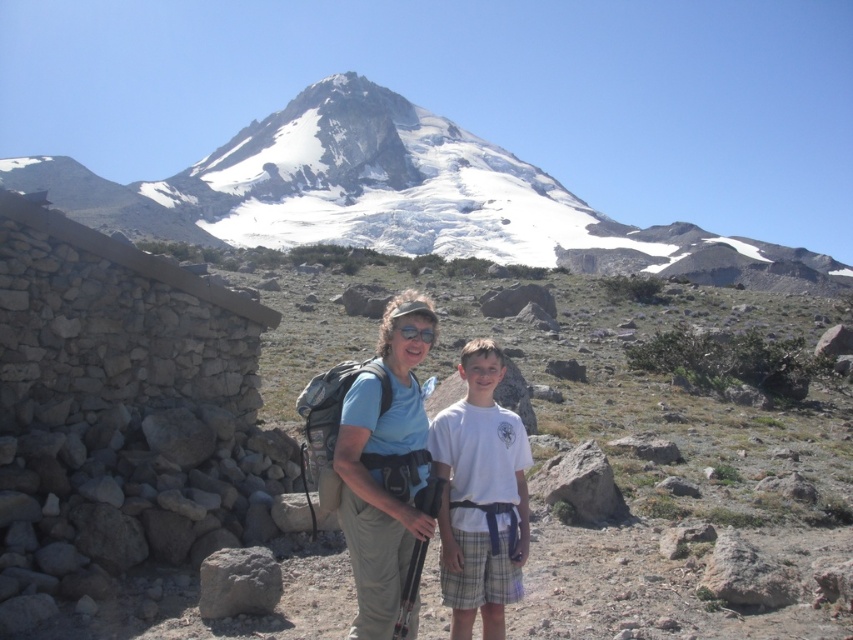
Question: Which of these objects is positioned closest to the matte blue shirt at center?

Choices:
 (A) white cotton shirt at center
 (B) white snow-covered mountain at upper center

Answer: (A)

Question: Does white snow-covered mountain at upper center appear under gray rough rock at lower left?

Choices:
 (A) yes
 (B) no

Answer: (B)

Question: Which of the following is the farthest from the observer?

Choices:
 (A) white cotton shirt at center
 (B) gray rough rock at lower left

Answer: (B)

Question: Among these points, which one is farthest from the camera?

Choices:
 (A) (374, 381)
 (B) (431, 214)
 (C) (248, 588)
 (D) (503, 493)

Answer: (B)

Question: Is the position of white cotton shirt at center more distant than that of gray rough rock at lower left?

Choices:
 (A) no
 (B) yes

Answer: (A)

Question: Can you confirm if white cotton shirt at center is bigger than gray rough rock at lower left?

Choices:
 (A) yes
 (B) no

Answer: (A)